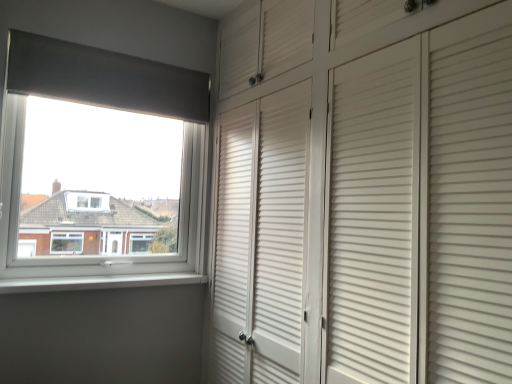
Where is `free space above white smooth window sill at lower left (from a real-world perspective)`? The height and width of the screenshot is (384, 512). free space above white smooth window sill at lower left (from a real-world perspective) is located at coordinates (104, 278).